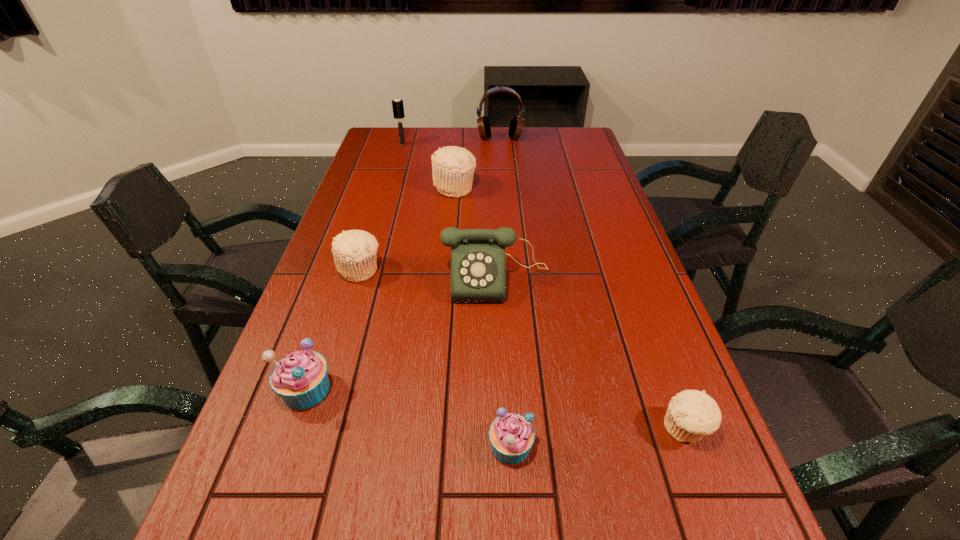
Where is `the right blue muffin`? Image resolution: width=960 pixels, height=540 pixels. the right blue muffin is located at coordinates (511, 435).

Locate an element on the screen. the rightmost beige muffin is located at coordinates (691, 414).

The width and height of the screenshot is (960, 540). In order to click on the rightmost muffin in this screenshot , I will do `click(691, 414)`.

This screenshot has height=540, width=960. Find the location of `free point located on the ear pads of the black headset`. free point located on the ear pads of the black headset is located at coordinates (503, 174).

In order to click on free region located on the front of the hairbrush in this screenshot , I will do tap(399, 157).

Find the location of `blank space located on the right of the farthest beige muffin`. blank space located on the right of the farthest beige muffin is located at coordinates (539, 187).

Identify the location of free space located on the dial of the telephone. Image resolution: width=960 pixels, height=540 pixels. (500, 363).

You are a GUI agent. You are given a task and a screenshot of the screen. Output one action in this format:
    pyautogui.click(x=<x>, y=<y>)
    Task: Click on the free space located 0.230m on the right of the bigger blue muffin
    
    Given the screenshot: What is the action you would take?
    pyautogui.click(x=444, y=389)

Where is `vacant area located 0.110m on the back of the second biggest beige muffin`? This screenshot has height=540, width=960. vacant area located 0.110m on the back of the second biggest beige muffin is located at coordinates (372, 232).

Locate an element on the screen. The height and width of the screenshot is (540, 960). free space located on the right of the second muffin from right to left is located at coordinates (658, 446).